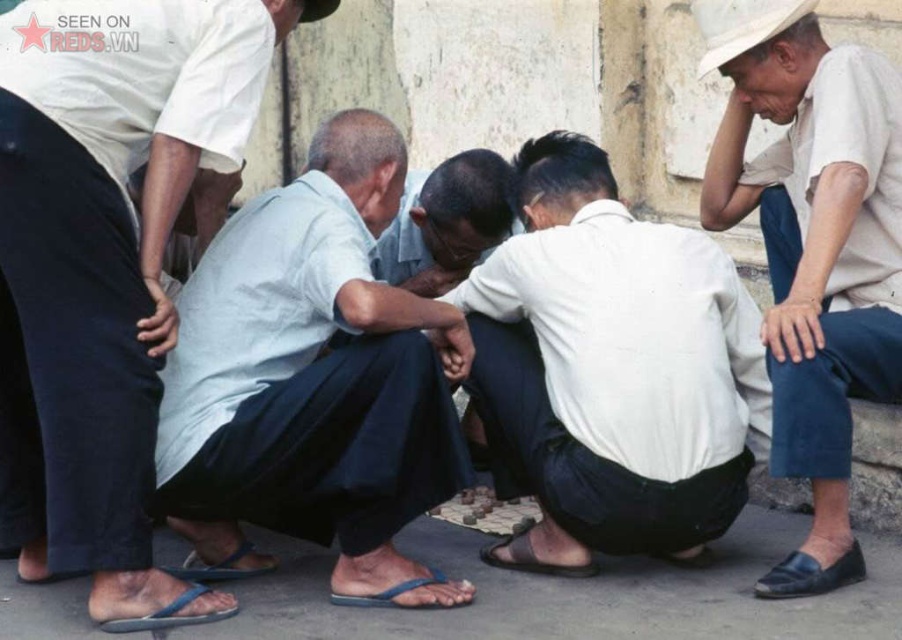
Consider the image. You are a photographer trying to capture a closeup of the light blue fabric at center without including the black leather sandal at lower center in the frame. Based on their positions, is this possible?

The light blue fabric at center is located above the black leather sandal at lower center, so it is possible to capture a closeup of the light blue fabric at center without including the sandal by adjusting the camera angle to focus on the higher position of the fabric.